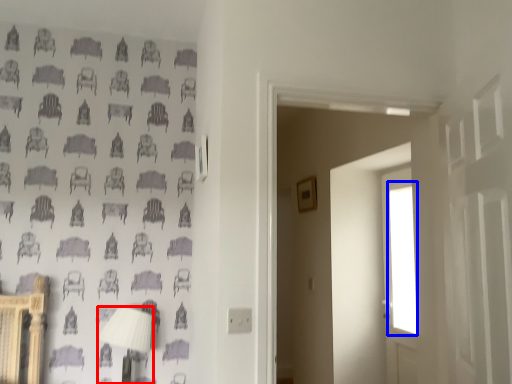
Question: Which of the following is the closest to the observer, table lamp (highlighted by a red box) or window (highlighted by a blue box)?

Choices:
 (A) table lamp
 (B) window

Answer: (A)